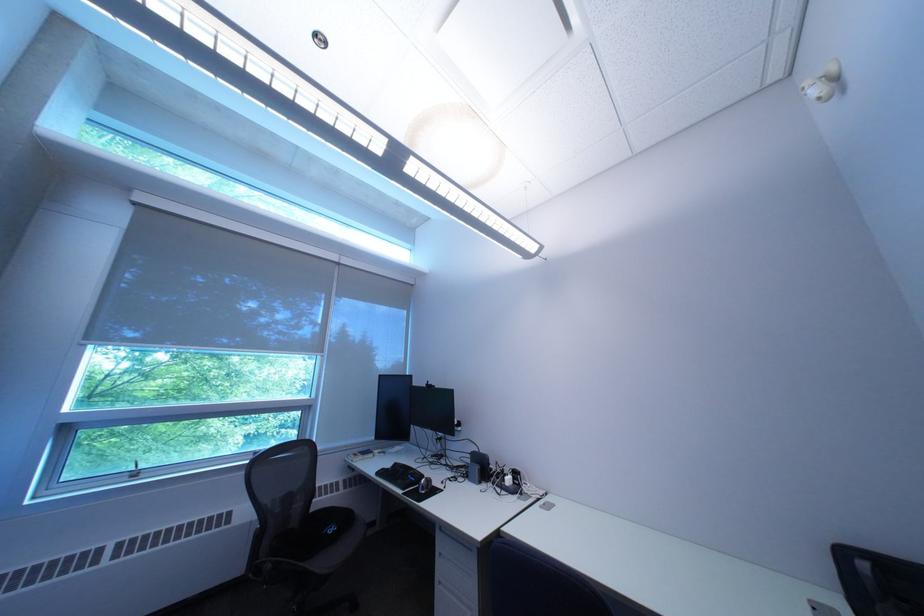
Where is `black computer keyboard`? The image size is (924, 616). black computer keyboard is located at coordinates (399, 476).